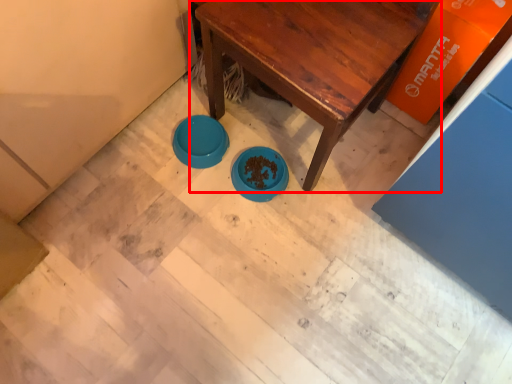
Question: From the image's perspective, what is the correct spatial relationship of table (annotated by the red box) in relation to basin?

Choices:
 (A) below
 (B) above

Answer: (B)